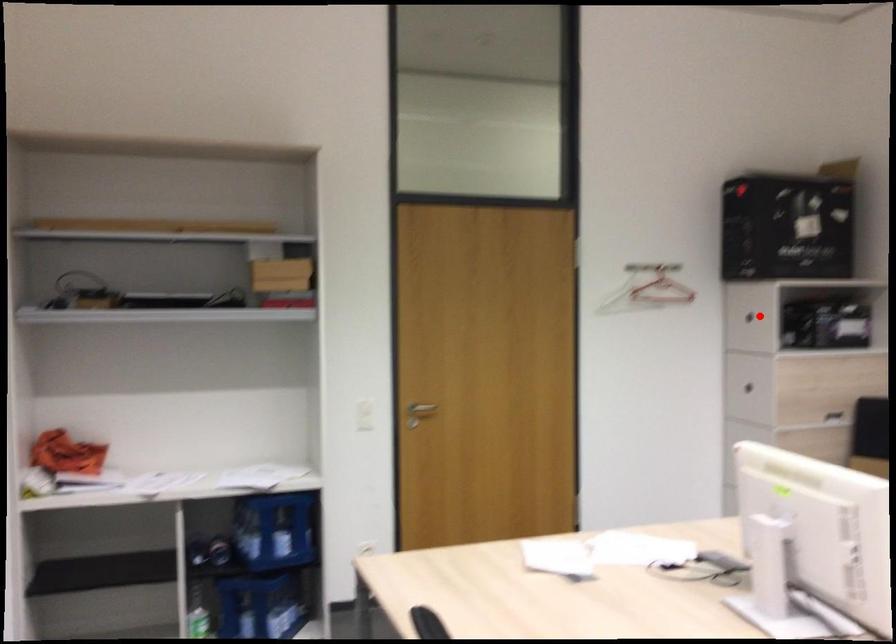
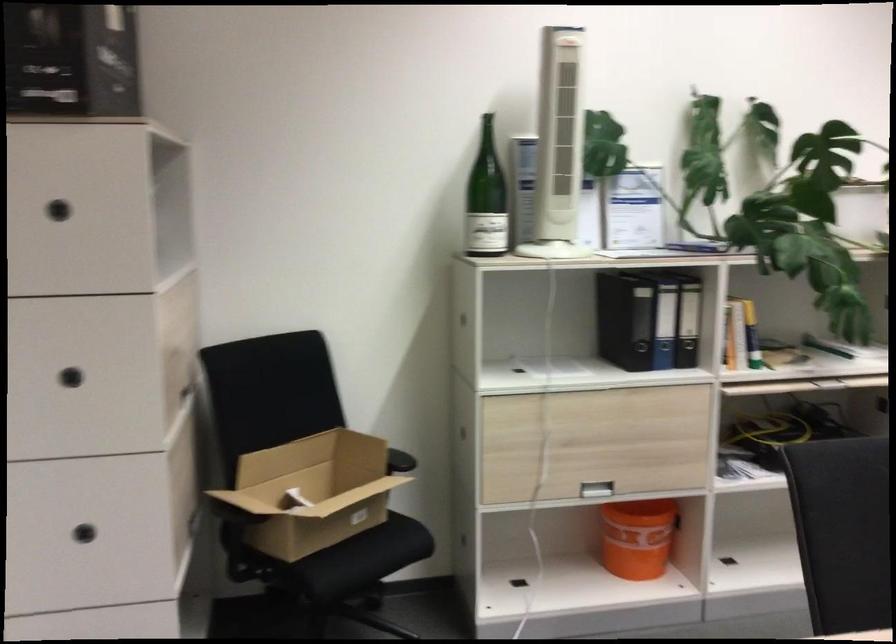
Question: I am providing you with two images of the same scene from different viewpoints. A red point is shown in image1. For the corresponding object point in image2, is it positioned nearer or farther from the camera?

Choices:
 (A) Nearer
 (B) Farther

Answer: (A)